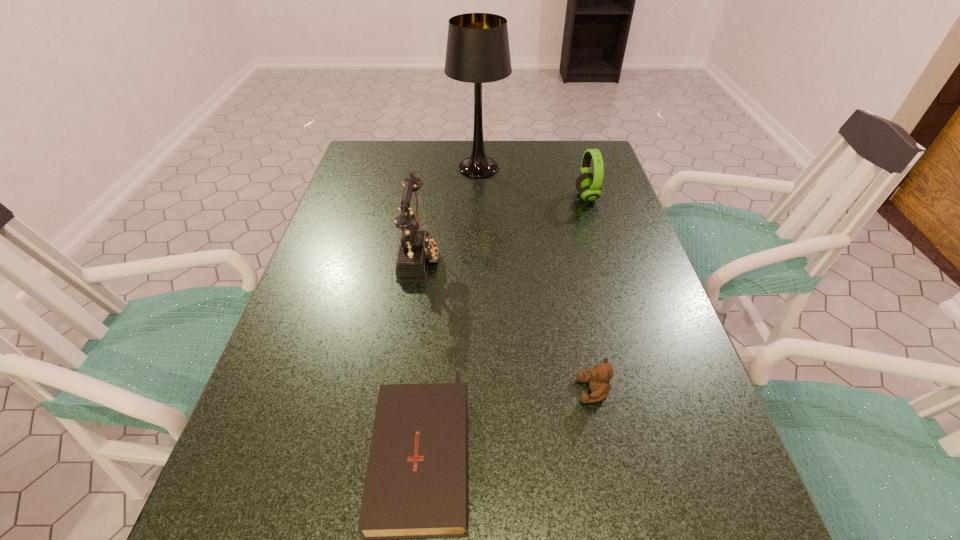
This screenshot has width=960, height=540. I want to click on free location located 0.210m on the back of the second farthest object, so tap(573, 152).

Locate an element on the screen. This screenshot has height=540, width=960. free space located on the front-facing side of the second object from right to left is located at coordinates (402, 391).

I want to click on blank space located on the front-facing side of the second object from right to left, so click(498, 391).

What are the coordinates of `free spot located on the front-facing side of the second object from right to left` in the screenshot? It's located at (444, 391).

At what (x,y) coordinates should I click in order to perform the action: click on object that is positioned at the far edge. Please return your answer as a coordinate pair (x, y). Looking at the image, I should click on (477, 51).

Identify the location of object at the right edge. The image size is (960, 540). (588, 185).

You are a GUI agent. You are given a task and a screenshot of the screen. Output one action in this format:
    pyautogui.click(x=<x>, y=<y>)
    Task: Click on the vacant space at the left edge of the desktop
    The image size is (960, 540).
    Given the screenshot: What is the action you would take?
    pyautogui.click(x=377, y=246)

Image resolution: width=960 pixels, height=540 pixels. What are the coordinates of `vacant space at the right edge of the desktop` in the screenshot? It's located at (617, 239).

In the image, there is a desktop. Where is `free space at the far left corner`? The image size is (960, 540). free space at the far left corner is located at coordinates (381, 148).

The width and height of the screenshot is (960, 540). In order to click on vacant point at the far right corner in this screenshot , I will do `click(583, 150)`.